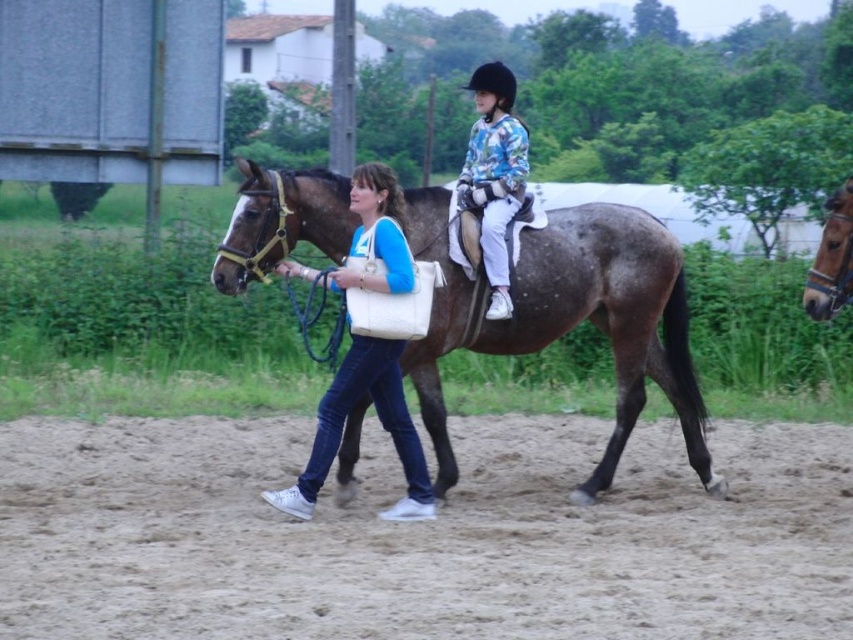
Is blue denim jeans at center shorter than floral jersey at center?

No, blue denim jeans at center is not shorter than floral jersey at center.

Does blue denim jeans at center appear on the right side of floral jersey at center?

In fact, blue denim jeans at center is to the left of floral jersey at center.

Does point (366, 388) come in front of point (474, 189)?

Yes, point (366, 388) is closer to viewer.

Where is `blue denim jeans at center`? blue denim jeans at center is located at coordinates (380, 420).

Who is taller, brown sandy ground at lower center or floral jersey at center?

floral jersey at center

Is brown sandy ground at lower center in front of floral jersey at center?

Yes, it is.

Where is `brown sandy ground at lower center`? The image size is (853, 640). brown sandy ground at lower center is located at coordinates (421, 534).

Is brown sandy ground at lower center thinner than blue denim jeans at center?

Incorrect, brown sandy ground at lower center's width is not less than blue denim jeans at center's.

Based on the photo, does brown sandy ground at lower center lie behind blue denim jeans at center?

No, it is in front of blue denim jeans at center.

You are a GUI agent. You are given a task and a screenshot of the screen. Output one action in this format:
    pyautogui.click(x=<x>, y=<y>)
    Task: Click on the brown sandy ground at lower center
    
    Given the screenshot: What is the action you would take?
    pyautogui.click(x=421, y=534)